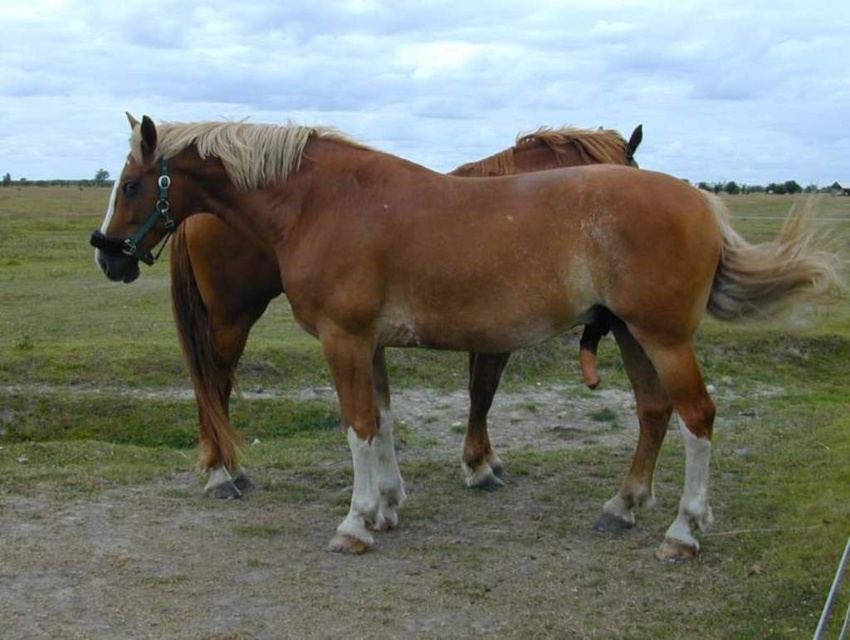
Is brown glossy horse at center thinner than blonde silky tail at right?

Correct, brown glossy horse at center's width is less than blonde silky tail at right's.

Who is more forward, [503,205] or [706,192]?

Point [503,205]

I want to click on brown glossy horse at center, so click(x=468, y=275).